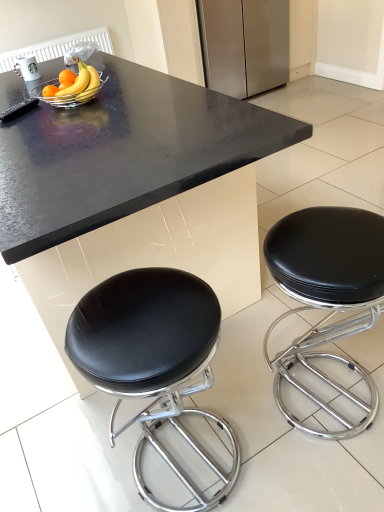
Question: From the image's perspective, relative to stainless steel refrigerator at upper center, is black leather stool at lower right, the 1th stool viewed from the left, above or below?

Choices:
 (A) above
 (B) below

Answer: (B)

Question: In terms of size, does black leather stool at lower right, the 1th stool viewed from the left, appear bigger or smaller than stainless steel refrigerator at upper center?

Choices:
 (A) big
 (B) small

Answer: (B)

Question: Estimate the real-world distances between objects in this image. Which object is farther from the stainless steel refrigerator at upper center?

Choices:
 (A) yellow matte banana at center, marked as the second banana in a front-to-back arrangement
 (B) metallic silver bowl at upper center
 (C) yellow matte bananas at upper left, the 2th banana when ordered from back to front
 (D) black leather stool at lower right, the 1th stool viewed from the left
 (E) black leather stool at lower right, acting as the first stool starting from the right

Answer: (D)

Question: Estimate the real-world distances between objects in this image. Which object is farther from the stainless steel refrigerator at upper center?

Choices:
 (A) black leather stool at lower right, the 1th stool viewed from the left
 (B) metallic silver bowl at upper center
 (C) yellow matte bananas at upper left, placed as the 1th banana when sorted from front to back
 (D) black granite table at center
 (E) black leather stool at lower right, acting as the first stool starting from the right

Answer: (A)